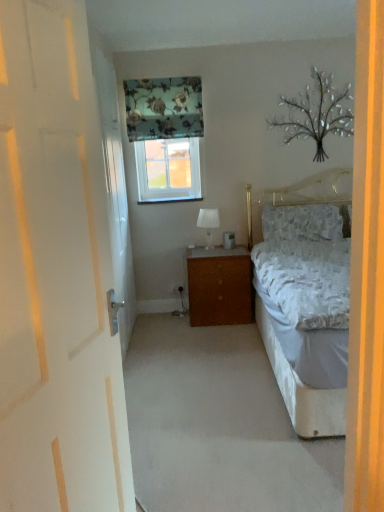
Question: From a real-world perspective, is fluffy white pillow at center physically located above or below white wooden door at left?

Choices:
 (A) below
 (B) above

Answer: (A)

Question: Considering the positions of fluffy white pillow at center and white wooden door at left in the image, is fluffy white pillow at center bigger or smaller than white wooden door at left?

Choices:
 (A) small
 (B) big

Answer: (A)

Question: Considering the real-world distances, which object is farthest from the white fabric lampshade at center?

Choices:
 (A) white wooden door at left
 (B) fluffy white pillow at center
 (C) metallic silver tree at upper right
 (D) floral fabric curtain at upper center
 (E) brown wood nightstand at center

Answer: (A)

Question: Which object is the closest to the metallic silver tree at upper right?

Choices:
 (A) white fabric lampshade at center
 (B) brown wood nightstand at center
 (C) floral fabric curtain at upper center
 (D) fluffy white pillow at center
 (E) white wooden door at left

Answer: (D)